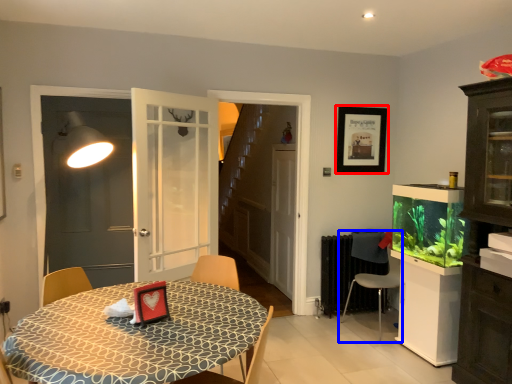
Question: Which point is further to the camera, picture frame (highlighted by a red box) or chair (highlighted by a blue box)?

Choices:
 (A) picture frame
 (B) chair

Answer: (A)